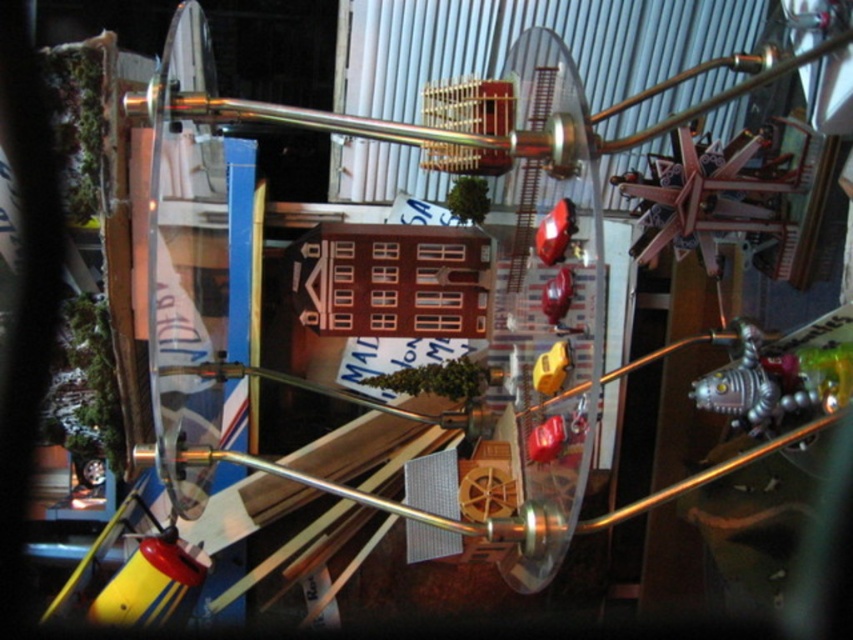
Question: Which point is closer to the camera?

Choices:
 (A) glossy red car at center
 (B) glossy plastic apple at center
 (C) metallic silver star at upper right
 (D) yellow plastic toy at center

Answer: (B)

Question: Does glossy plastic apple at center have a greater width compared to glossy red car at center?

Choices:
 (A) no
 (B) yes

Answer: (B)

Question: Which object is the closest to the glossy plastic car at center?

Choices:
 (A) glossy red car at center
 (B) glossy plastic apple at center
 (C) metallic silver star at upper right
 (D) yellow plastic toy at center

Answer: (A)

Question: Considering the relative positions of glossy plastic apple at center and glossy red car at center in the image provided, where is glossy plastic apple at center located with respect to glossy red car at center?

Choices:
 (A) above
 (B) below

Answer: (B)

Question: Among these points, which one is farthest from the camera?

Choices:
 (A) (561, 358)
 (B) (572, 218)

Answer: (A)

Question: Does yellow plastic toy at center have a larger size compared to glossy red car at center?

Choices:
 (A) no
 (B) yes

Answer: (B)